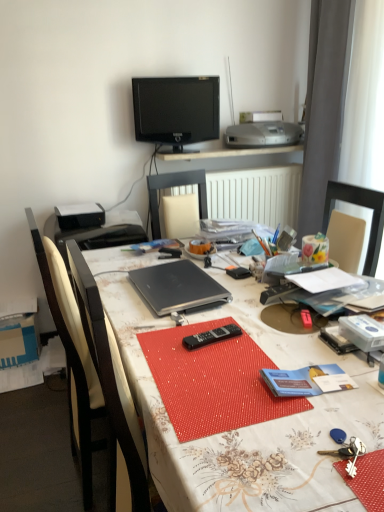
Identify the location of vacant area that lies to the right of black plastic remote at center. (271, 337).